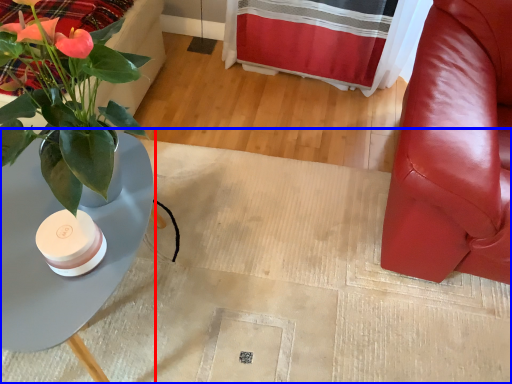
Question: Which point is closer to the camera, table (highlighted by a red box) or plain (highlighted by a blue box)?

Choices:
 (A) table
 (B) plain

Answer: (A)